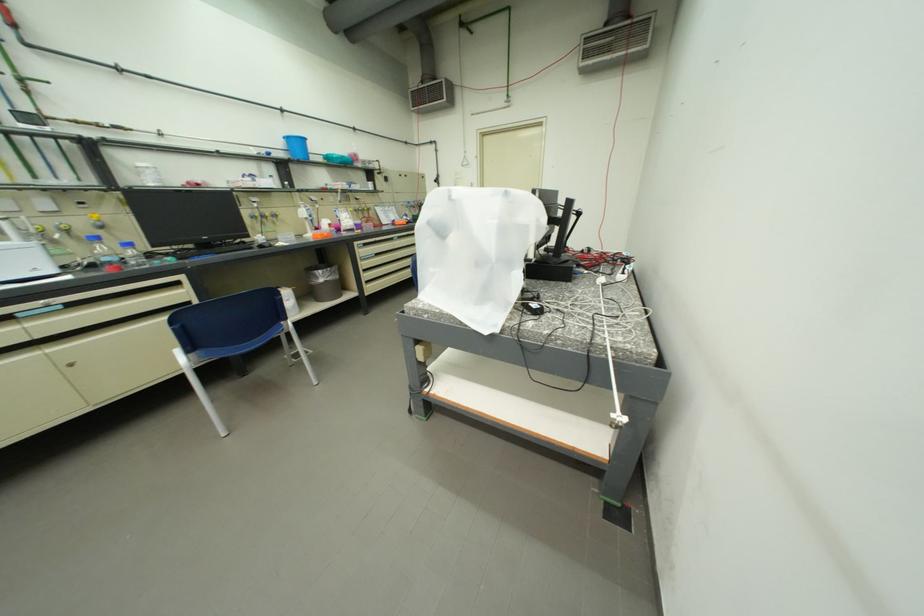
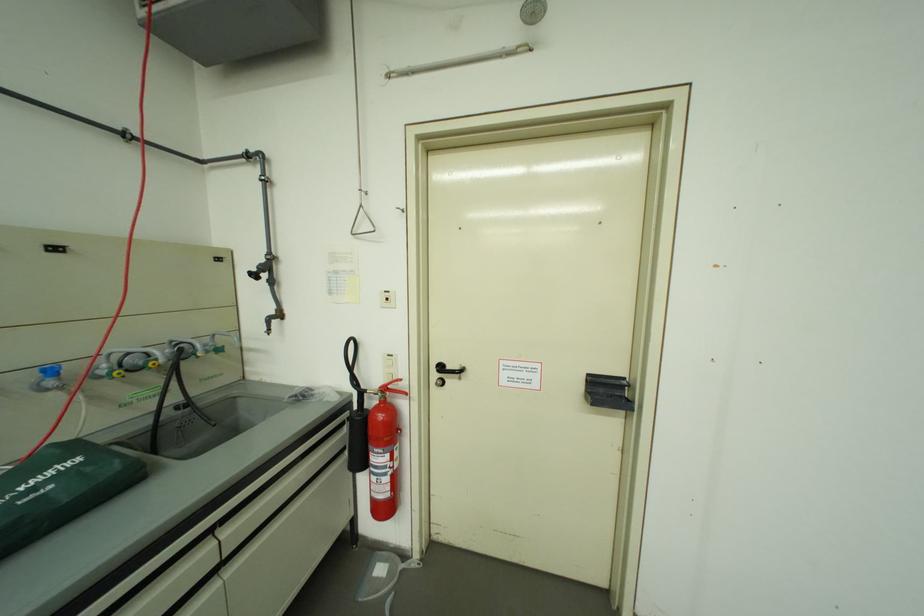
The point at (418, 205) is marked in the first image. Where is the corresponding point in the second image?

(62, 373)